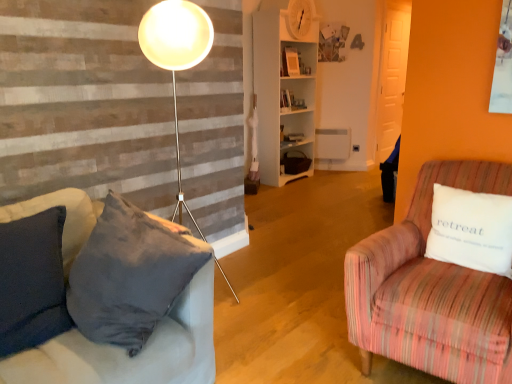
Question: Based on their sizes in the image, would you say white wooden shelf at center is bigger or smaller than white cotton pillow at right?

Choices:
 (A) small
 (B) big

Answer: (B)

Question: From a real-world perspective, is white wooden shelf at center physically located above or below white cotton pillow at right?

Choices:
 (A) below
 (B) above

Answer: (B)

Question: Estimate the real-world distances between objects in this image. Which object is farther from the striped fabric armchair at right?

Choices:
 (A) white cotton pillow at right
 (B) white wooden shelf at center

Answer: (B)

Question: Estimate the real-world distances between objects in this image. Which object is farther from the white wooden shelf at center?

Choices:
 (A) striped fabric armchair at right
 (B) white cotton pillow at right

Answer: (B)